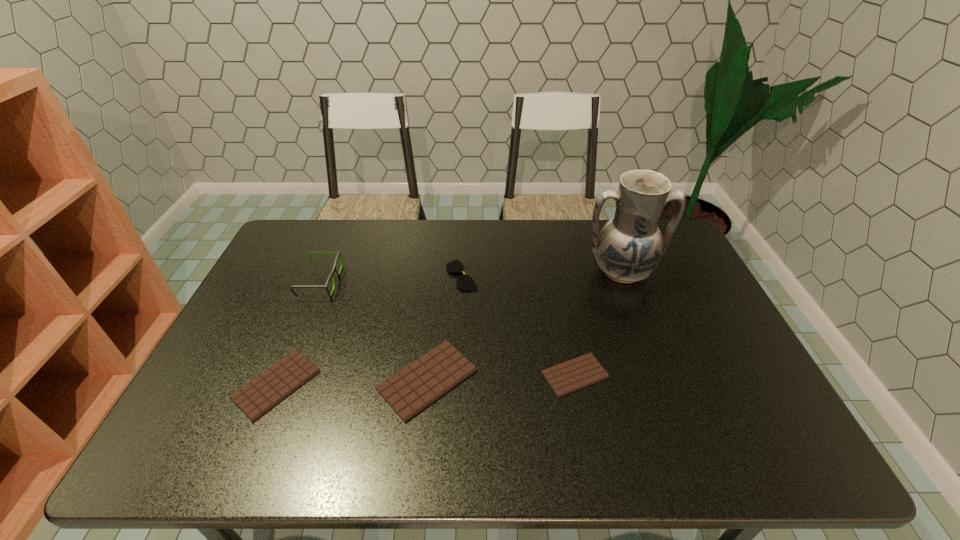
This screenshot has height=540, width=960. What are the coordinates of `free spot located 0.220m on the back of the second chocolate bar from left to right` in the screenshot? It's located at (437, 288).

Identify the location of vacant space situated 0.180m on the right of the rightmost chocolate bar. (679, 375).

At what (x,y) coordinates should I click in order to perform the action: click on free space located on the front-facing side of the pitcher. Please return your answer as a coordinate pair (x, y). Looking at the image, I should click on [x=648, y=343].

In order to click on vacant space located 0.350m on the right of the shorter spectacles in this screenshot , I will do `click(588, 275)`.

The width and height of the screenshot is (960, 540). I want to click on free location located 0.260m on the lens of the left spectacles, so click(x=420, y=282).

You are a GUI agent. You are given a task and a screenshot of the screen. Output one action in this format:
    pyautogui.click(x=<x>, y=<y>)
    Task: Click on the pitcher present at the far edge
    The width and height of the screenshot is (960, 540).
    Given the screenshot: What is the action you would take?
    pyautogui.click(x=629, y=248)

Where is `spectacles that is positioned at the far edge`? spectacles that is positioned at the far edge is located at coordinates (465, 282).

Where is `chocolate bar that is positioned at the left edge`? The width and height of the screenshot is (960, 540). chocolate bar that is positioned at the left edge is located at coordinates (258, 396).

Identify the location of spectacles that is at the left edge. (339, 254).

Locate an element on the screen. The height and width of the screenshot is (540, 960). object that is at the right edge is located at coordinates (629, 248).